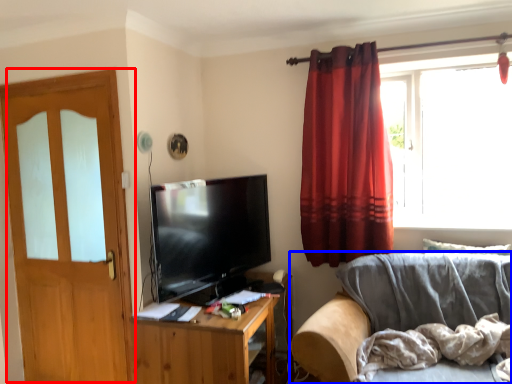
Question: Among these objects, which one is nearest to the camera, door (highlighted by a red box) or studio couch (highlighted by a blue box)?

Choices:
 (A) door
 (B) studio couch

Answer: (B)